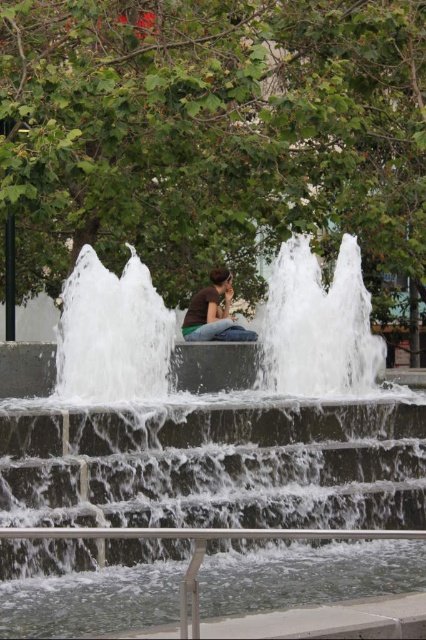
Is white concrete fountain at center further to the viewer compared to matte brown shirt at center?

No, it is not.

Is white concrete fountain at center thinner than matte brown shirt at center?

No, white concrete fountain at center is not thinner than matte brown shirt at center.

Who is more distant from viewer, (351, 410) or (193, 330)?

The point (193, 330) is more distant.

At what (x,y) coordinates should I click in order to perform the action: click on white concrete fountain at center. Please return your answer as a coordinate pair (x, y). The image size is (426, 640). Looking at the image, I should click on (216, 417).